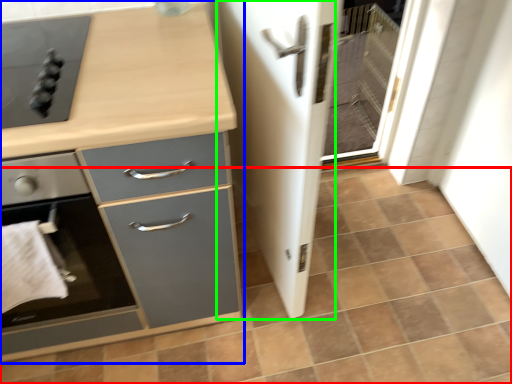
Question: Which is nearer to the tile (highlighted by a red box)? chest of drawers (highlighted by a blue box) or screen door (highlighted by a green box).

Choices:
 (A) chest of drawers
 (B) screen door

Answer: (B)